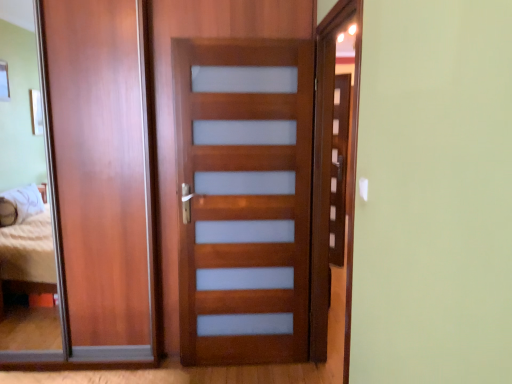
What do you see at coordinates (330, 172) in the screenshot?
I see `matte wood screen door at right, acting as the 1th screen door starting from the right` at bounding box center [330, 172].

Where is `satin wood door at center, acting as the second screen door starting from the right`? This screenshot has height=384, width=512. satin wood door at center, acting as the second screen door starting from the right is located at coordinates (243, 198).

Choose the correct answer: Is matte wood barn door at left inside matte wood screen door at right, acting as the 1th screen door starting from the right, or outside it?

matte wood barn door at left lies outside matte wood screen door at right, acting as the 1th screen door starting from the right.

The width and height of the screenshot is (512, 384). In order to click on screen door that is the 1st object directly below the matte wood barn door at left (from a real-world perspective) in this screenshot , I will do `click(330, 172)`.

Considering the sizes of objects matte wood barn door at left and matte wood screen door at right, which is the 2th screen door in left-to-right order, in the image provided, who is bigger, matte wood barn door at left or matte wood screen door at right, which is the 2th screen door in left-to-right order,?

Bigger between the two is matte wood barn door at left.

From a real-world perspective, between matte wood barn door at left and matte wood screen door at right, which is the 2th screen door in left-to-right order, who is vertically lower?

In real-world perspective, matte wood screen door at right, which is the 2th screen door in left-to-right order, is lower.

Can you confirm if satin wood door at center, acting as the second screen door starting from the right, is positioned to the right of matte wood barn door at left?

Indeed, satin wood door at center, acting as the second screen door starting from the right, is positioned on the right side of matte wood barn door at left.

Does point (284, 171) come behind point (113, 4)?

That is True.

Do you think satin wood door at center, which is the first screen door from left to right, is within matte wood barn door at left, or outside of it?

satin wood door at center, which is the first screen door from left to right, is outside matte wood barn door at left.

Is satin wood door at center, acting as the second screen door starting from the right, in contact with matte wood barn door at left?

No, satin wood door at center, acting as the second screen door starting from the right, is not making contact with matte wood barn door at left.

Locate an element on the screen. This screenshot has width=512, height=384. barn door that appears behind the matte wood screen door at right, acting as the 1th screen door starting from the right is located at coordinates (102, 175).

Is matte wood screen door at right, acting as the 1th screen door starting from the right, oriented towards matte wood barn door at left?

Yes.

Between matte wood screen door at right, acting as the 1th screen door starting from the right, and matte wood barn door at left, which one has larger width?

Wider between the two is matte wood barn door at left.

Which object is further away from the camera taking this photo, matte wood screen door at right, acting as the 1th screen door starting from the right, or satin wood door at center, acting as the second screen door starting from the right?

satin wood door at center, acting as the second screen door starting from the right, is behind.

Which is closer to the camera, (361, 54) or (194, 81)?

The point (361, 54) is closer to the camera.

Based on their positions, is matte wood screen door at right, which is the 2th screen door in left-to-right order, located to the left or right of satin wood door at center, which is the first screen door from left to right?

Based on their positions, matte wood screen door at right, which is the 2th screen door in left-to-right order, is located to the right of satin wood door at center, which is the first screen door from left to right.

Does matte wood screen door at right, which is the 2th screen door in left-to-right order, have a smaller size compared to satin wood door at center, acting as the second screen door starting from the right?

Yes, matte wood screen door at right, which is the 2th screen door in left-to-right order, is smaller than satin wood door at center, acting as the second screen door starting from the right.

Is satin wood door at center, which is the first screen door from left to right, facing away from matte wood screen door at right, acting as the 1th screen door starting from the right?

No.

Would you consider satin wood door at center, acting as the second screen door starting from the right, to be distant from matte wood screen door at right, which is the 2th screen door in left-to-right order?

Actually, satin wood door at center, acting as the second screen door starting from the right, and matte wood screen door at right, which is the 2th screen door in left-to-right order, are a little close together.

Can you confirm if satin wood door at center, which is the first screen door from left to right, is taller than matte wood screen door at right, which is the 2th screen door in left-to-right order?

In fact, satin wood door at center, which is the first screen door from left to right, may be shorter than matte wood screen door at right, which is the 2th screen door in left-to-right order.

Considering the sizes of satin wood door at center, which is the first screen door from left to right, and matte wood screen door at right, which is the 2th screen door in left-to-right order, in the image, is satin wood door at center, which is the first screen door from left to right, wider or thinner than matte wood screen door at right, which is the 2th screen door in left-to-right order,?

Clearly, satin wood door at center, which is the first screen door from left to right, has more width compared to matte wood screen door at right, which is the 2th screen door in left-to-right order.

Between matte wood barn door at left and satin wood door at center, acting as the second screen door starting from the right, which one appears on the right side from the viewer's perspective?

Positioned to the right is satin wood door at center, acting as the second screen door starting from the right.

Based on the photo, does matte wood barn door at left have a lesser height compared to satin wood door at center, acting as the second screen door starting from the right?

In fact, matte wood barn door at left may be taller than satin wood door at center, acting as the second screen door starting from the right.

Which object is further away from the camera, matte wood barn door at left or satin wood door at center, acting as the second screen door starting from the right?

matte wood barn door at left.

Is point (146, 342) positioned before point (273, 129)?

No.

Find the location of a particular element. barn door located above the matte wood screen door at right, which is the 2th screen door in left-to-right order (from a real-world perspective) is located at coordinates (102, 175).

You are a GUI agent. You are given a task and a screenshot of the screen. Output one action in this format:
    pyautogui.click(x=<x>, y=<y>)
    Task: Click on the barn door above the satin wood door at center, acting as the second screen door starting from the right (from the image's perspective)
    The image size is (512, 384).
    Given the screenshot: What is the action you would take?
    pyautogui.click(x=102, y=175)

Based on their spatial positions, is satin wood door at center, which is the first screen door from left to right, or matte wood screen door at right, acting as the 1th screen door starting from the right, closer to matte wood barn door at left?

Among the two, satin wood door at center, which is the first screen door from left to right, is located nearer to matte wood barn door at left.

When comparing their distances from matte wood screen door at right, which is the 2th screen door in left-to-right order, does satin wood door at center, which is the first screen door from left to right, or matte wood barn door at left seem closer?

Among the two, satin wood door at center, which is the first screen door from left to right, is located nearer to matte wood screen door at right, which is the 2th screen door in left-to-right order.

Considering their positions, is matte wood screen door at right, which is the 2th screen door in left-to-right order, positioned closer to satin wood door at center, acting as the second screen door starting from the right, than matte wood barn door at left?

Based on the image, matte wood screen door at right, which is the 2th screen door in left-to-right order, appears to be nearer to satin wood door at center, acting as the second screen door starting from the right.

Looking at this image, when comparing their distances from matte wood barn door at left, does matte wood screen door at right, which is the 2th screen door in left-to-right order, or satin wood door at center, which is the first screen door from left to right, seem closer?

Based on the image, satin wood door at center, which is the first screen door from left to right, appears to be nearer to matte wood barn door at left.

From the picture: Looking at the image, which one is located further to satin wood door at center, acting as the second screen door starting from the right, matte wood barn door at left or matte wood screen door at right, which is the 2th screen door in left-to-right order?

matte wood barn door at left is positioned further to the anchor satin wood door at center, acting as the second screen door starting from the right.

When comparing their distances from matte wood screen door at right, acting as the 1th screen door starting from the right, does matte wood barn door at left or satin wood door at center, acting as the second screen door starting from the right, seem further?

Based on the image, matte wood barn door at left appears to be further to matte wood screen door at right, acting as the 1th screen door starting from the right.

Find the location of `screen door between matte wood barn door at left and matte wood screen door at right, which is the 2th screen door in left-to-right order`. screen door between matte wood barn door at left and matte wood screen door at right, which is the 2th screen door in left-to-right order is located at coordinates (243, 198).